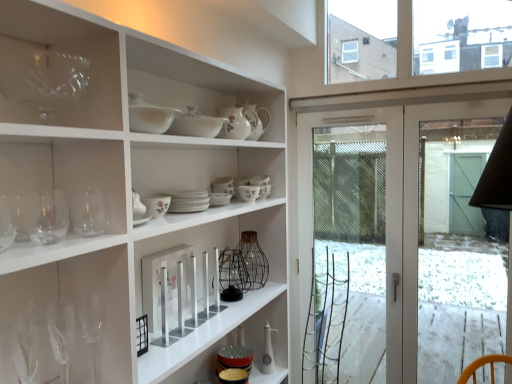
Image resolution: width=512 pixels, height=384 pixels. What do you see at coordinates (46, 216) in the screenshot? I see `transparent glass wine glass at left, which ranks as the second wine glass in front-to-back order` at bounding box center [46, 216].

Find the location of a particular element. floral ceramic bowl at center, the second tableware when ordered from back to front is located at coordinates (262, 184).

In order to face floral ceramic bowl at center, the second tableware when ordered from back to front, should I rotate leftwards or rightwards?

Rotate right and turn 0.932 degrees.

Identify the location of floral porcelain cup at center, the fifth tableware from the front. This screenshot has height=384, width=512. (248, 193).

Find the location of `transparent glass wine glass at lower left, the 1th wine glass positioned from the back`. transparent glass wine glass at lower left, the 1th wine glass positioned from the back is located at coordinates (92, 329).

This screenshot has height=384, width=512. Describe the element at coordinates (89, 212) in the screenshot. I see `transparent glass wine glass at left, positioned as the fourth wine glass in front-to-back order` at that location.

At what (x,y) coordinates should I click in order to perform the action: click on transparent glass wine glass at left, which ranks as the second wine glass in front-to-back order. Please return your answer as a coordinate pair (x, y). The height and width of the screenshot is (384, 512). Looking at the image, I should click on (46, 216).

In the scene shown: How many degrees apart are the facing directions of transparent glass at upper left and clear glass wine glass at left, positioned as the 1th wine glass in front-to-back order?

The angle between the facing direction of transparent glass at upper left and the facing direction of clear glass wine glass at left, positioned as the 1th wine glass in front-to-back order, is 0.424 degrees.

Between transparent glass at upper left and clear glass wine glass at left, the 5th wine glass from the back, which one has more height?

transparent glass at upper left is taller.

From the image's perspective, between transparent glass at upper left and clear glass wine glass at left, the 5th wine glass from the back, who is located below?

clear glass wine glass at left, the 5th wine glass from the back, from the image's perspective.

From a real-world perspective, is transparent glass at upper left positioned under clear glass wine glass at left, the 5th wine glass from the back, based on gravity?

No, from a real-world perspective, transparent glass at upper left is not under clear glass wine glass at left, the 5th wine glass from the back.

Is point (468, 135) positioned before point (241, 186)?

No, (468, 135) is further to viewer.

Where is `tableware that is the 3rd one when counting forward from the transparent glass screen door at right`? The height and width of the screenshot is (384, 512). tableware that is the 3rd one when counting forward from the transparent glass screen door at right is located at coordinates click(248, 193).

From a real-world perspective, is transparent glass screen door at right positioned under floral porcelain cup at center, the 3th tableware ordered from the bottom, based on gravity?

Yes, from a real-world perspective, transparent glass screen door at right is beneath floral porcelain cup at center, the 3th tableware ordered from the bottom.

From the image's perspective, does transparent glass screen door at right appear higher than floral porcelain cup at center, the 3th tableware ordered from the bottom?

No, from the image's perspective, transparent glass screen door at right is not over floral porcelain cup at center, the 3th tableware ordered from the bottom.

Based on the photo, is transparent glass wine glass at left, positioned as the fourth wine glass in front-to-back order, aimed at clear glass wine glass at left, positioned as the 1th wine glass in front-to-back order?

No, transparent glass wine glass at left, positioned as the fourth wine glass in front-to-back order, is not facing towards clear glass wine glass at left, positioned as the 1th wine glass in front-to-back order.

From the image's perspective, would you say transparent glass wine glass at left, positioned as the fourth wine glass in front-to-back order, is shown under clear glass wine glass at left, the 5th wine glass from the back?

No.

Is the depth of transparent glass wine glass at left, the second wine glass from the back, less than that of clear glass wine glass at left, positioned as the 1th wine glass in front-to-back order?

No, transparent glass wine glass at left, the second wine glass from the back, is behind clear glass wine glass at left, positioned as the 1th wine glass in front-to-back order.

Can you confirm if transparent glass wine glass at left, the second wine glass from the back, is wider than clear glass wine glass at left, the 5th wine glass from the back?

Incorrect, the width of transparent glass wine glass at left, the second wine glass from the back, does not surpass that of clear glass wine glass at left, the 5th wine glass from the back.

Who is shorter, porcelain floral teapot at center, which is the 1th tableware in top-to-bottom order, or floral porcelain cup at center, which is the third tableware from back to front?

floral porcelain cup at center, which is the third tableware from back to front, is shorter.

Is porcelain floral teapot at center, marked as the fourth tableware in a front-to-back arrangement, in front of or behind floral porcelain cup at center, the fifth tableware from the front, in the image?

Visually, porcelain floral teapot at center, marked as the fourth tableware in a front-to-back arrangement, is located in front of floral porcelain cup at center, the fifth tableware from the front.

Considering the relative sizes of porcelain floral teapot at center, the fourth tableware in the back-to-front sequence, and floral porcelain cup at center, the 3th tableware ordered from the bottom, in the image provided, is porcelain floral teapot at center, the fourth tableware in the back-to-front sequence, bigger than floral porcelain cup at center, the 3th tableware ordered from the bottom,?

Indeed, porcelain floral teapot at center, the fourth tableware in the back-to-front sequence, has a larger size compared to floral porcelain cup at center, the 3th tableware ordered from the bottom.

Does point (197, 121) appear closer or farther from the camera than point (26, 209)?

Point (197, 121) is positioned farther from the camera compared to point (26, 209).

From their relative heights in the image, would you say white ceramic bowl at upper center, which is counted as the 2th tableware, starting from the top, is taller or shorter than transparent glass wine glass at left, the 4th wine glass positioned from the back?

Clearly, white ceramic bowl at upper center, which is counted as the 2th tableware, starting from the top, is shorter compared to transparent glass wine glass at left, the 4th wine glass positioned from the back.

Which object is thinner, white ceramic bowl at upper center, placed as the 6th tableware when sorted from back to front, or transparent glass wine glass at left, the 4th wine glass positioned from the back?

transparent glass wine glass at left, the 4th wine glass positioned from the back, is thinner.

Can you see white ceramic bowl at upper center, the 6th tableware positioned from the bottom, touching transparent glass wine glass at left, which ranks as the second wine glass in front-to-back order?

white ceramic bowl at upper center, the 6th tableware positioned from the bottom, is not next to transparent glass wine glass at left, which ranks as the second wine glass in front-to-back order, and they're not touching.

Is white ceramic bowl at upper center, the 6th tableware positioned from the bottom, wider or thinner than white ceramic bowl at upper center, acting as the 7th tableware starting from the back?

Considering their sizes, white ceramic bowl at upper center, the 6th tableware positioned from the bottom, looks broader than white ceramic bowl at upper center, acting as the 7th tableware starting from the back.

Looking at this image, from a real-world perspective, relative to white ceramic bowl at upper center, which appears as the third tableware when viewed from the top, is white ceramic bowl at upper center, the 6th tableware positioned from the bottom, vertically above or below?

In terms of real-world spatial position, white ceramic bowl at upper center, the 6th tableware positioned from the bottom, is below white ceramic bowl at upper center, which appears as the third tableware when viewed from the top.

Is white ceramic bowl at upper center, which is the second tableware in front-to-back order, next to white ceramic bowl at upper center, which is the 5th tableware in bottom-to-top order?

Yes, white ceramic bowl at upper center, which is the second tableware in front-to-back order, and white ceramic bowl at upper center, which is the 5th tableware in bottom-to-top order, clearly make contact.

Considering the positions of point (196, 132) and point (135, 114), is point (196, 132) closer or farther from the camera than point (135, 114)?

Point (196, 132) is positioned farther from the camera compared to point (135, 114).

Is point (257, 181) positioned before point (98, 350)?

No, it is not.

Between floral ceramic bowl at center, the fourth tableware from the bottom, and transparent glass wine glass at lower left, the 5th wine glass positioned from the front, which one appears on the right side from the viewer's perspective?

From the viewer's perspective, floral ceramic bowl at center, the fourth tableware from the bottom, appears more on the right side.

How many degrees apart are the facing directions of floral ceramic bowl at center, the 6th tableware when ordered from front to back, and transparent glass wine glass at lower left, the 1th wine glass positioned from the back?

0.36 degrees separate the facing orientations of floral ceramic bowl at center, the 6th tableware when ordered from front to back, and transparent glass wine glass at lower left, the 1th wine glass positioned from the back.

From a real-world perspective, starting from the transparent glass wine glass at lower left, the 5th wine glass positioned from the front, which tableware is the 1st one vertically above it? Please provide its 2D coordinates.

[(262, 184)]

I want to click on wine glass in front of the transparent glass at upper left, so click(x=6, y=225).

Where is `screen door that is under the floral porcelain cup at center, the fifth tableware from the top (from a real-world perspective)`? screen door that is under the floral porcelain cup at center, the fifth tableware from the top (from a real-world perspective) is located at coordinates (409, 226).

Looking at the image, which one is located closer to clear glass wine glass at lower left, which is counted as the third wine glass, starting from the front, matte white ceramic oil bottle at center, acting as the seventh tableware starting from the top, or transparent glass wine glass at left, which ranks as the second wine glass in front-to-back order?

Among the two, transparent glass wine glass at left, which ranks as the second wine glass in front-to-back order, is located nearer to clear glass wine glass at lower left, which is counted as the third wine glass, starting from the front.

Which object lies further to the anchor point transparent glass wine glass at left, positioned as the fourth wine glass in front-to-back order, floral ceramic bowl at center, which appears as the fourth tableware when viewed from the top, or matte white ceramic oil bottle at center, which is counted as the first tableware, starting from the bottom?

Based on the image, matte white ceramic oil bottle at center, which is counted as the first tableware, starting from the bottom, appears to be further to transparent glass wine glass at left, positioned as the fourth wine glass in front-to-back order.

When comparing their distances from transparent glass screen door at right, does floral porcelain cup at center, which is the third tableware from back to front, or floral ceramic bowl at center, which appears as the fourth tableware when viewed from the top, seem further?

Among the two, floral porcelain cup at center, which is the third tableware from back to front, is located further to transparent glass screen door at right.

Based on the photo, when comparing their distances from transparent glass wine glass at left, which ranks as the second wine glass in front-to-back order, does clear glass wine glass at left, the 5th wine glass from the back, or floral ceramic bowl at center, the fourth tableware from the bottom, seem closer?

clear glass wine glass at left, the 5th wine glass from the back, is closer to transparent glass wine glass at left, which ranks as the second wine glass in front-to-back order.

Considering their positions, is floral porcelain cup at center, the fifth tableware from the top, positioned further to matte white ceramic oil bottle at center, which is counted as the first tableware, starting from the bottom, than transparent glass wine glass at left, the second wine glass from the back?

The object further to matte white ceramic oil bottle at center, which is counted as the first tableware, starting from the bottom, is transparent glass wine glass at left, the second wine glass from the back.

When comparing their distances from white ceramic bowl at upper center, which is counted as the 2th tableware, starting from the top, does transparent glass wine glass at left, which ranks as the second wine glass in front-to-back order, or clear glass wine glass at left, positioned as the 1th wine glass in front-to-back order, seem closer?

transparent glass wine glass at left, which ranks as the second wine glass in front-to-back order, lies closer to white ceramic bowl at upper center, which is counted as the 2th tableware, starting from the top, than the other object.

Estimate the real-world distances between objects in this image. Which object is closer to transparent glass at upper left, transparent glass wine glass at lower left, the 1th wine glass positioned from the back, or porcelain floral teapot at center, marked as the fourth tableware in a front-to-back arrangement?

Based on the image, transparent glass wine glass at lower left, the 1th wine glass positioned from the back, appears to be nearer to transparent glass at upper left.

Looking at this image, when comparing their distances from transparent glass screen door at right, does white ceramic plates at center, the 3th tableware when ordered from front to back, or floral porcelain cup at center, the 3th tableware ordered from the bottom, seem closer?

floral porcelain cup at center, the 3th tableware ordered from the bottom, is closer to transparent glass screen door at right.

Find the location of `tableware between floral ceramic bowl at center, the 6th tableware when ordered from front to back, and transparent glass screen door at right`. tableware between floral ceramic bowl at center, the 6th tableware when ordered from front to back, and transparent glass screen door at right is located at coordinates (268, 352).

Locate an element on the screen. Image resolution: width=512 pixels, height=384 pixels. wine glass between transparent glass wine glass at left, the second wine glass from the back, and transparent glass screen door at right is located at coordinates (92, 329).

You are a GUI agent. You are given a task and a screenshot of the screen. Output one action in this format:
    pyautogui.click(x=<x>, y=<y>)
    Task: Click on the tableware positioned between transparent glass wine glass at left, the 4th wine glass positioned from the back, and white ceramic bowl at upper center, the 6th tableware positioned from the bottom, from near to far
    This screenshot has width=512, height=384.
    Given the screenshot: What is the action you would take?
    pyautogui.click(x=149, y=116)

Identify the location of shelf between porcelain floral teapot at center, placed as the seventh tableware when sorted from bottom to top, and matte white ceramic oil bottle at center, acting as the seventh tableware starting from the top, from top to bottom. This screenshot has width=512, height=384. (70, 53).